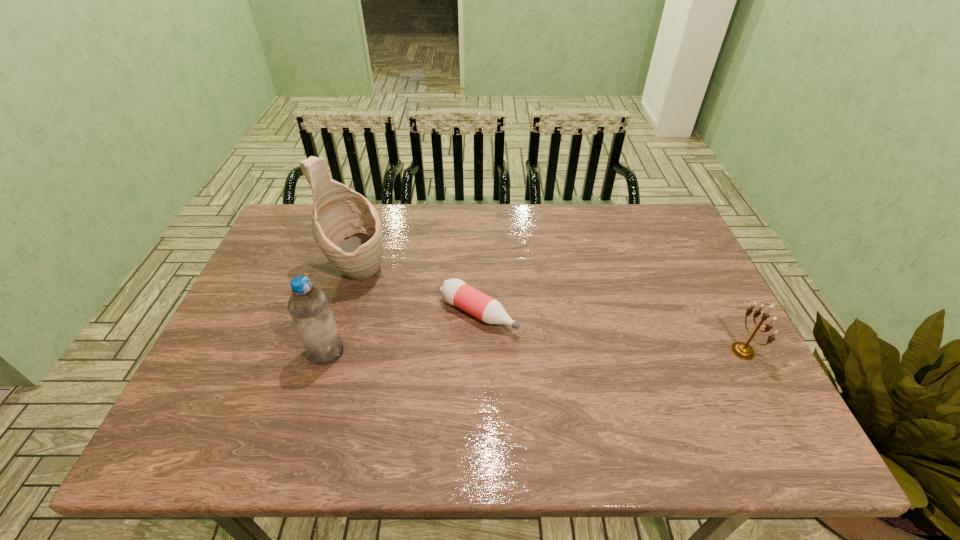
Find the location of a particular element. the third shortest object is located at coordinates (309, 308).

Find the location of a particular element. This screenshot has height=540, width=960. the third tallest object is located at coordinates (744, 351).

The image size is (960, 540). Identify the location of the rightmost object. (744, 351).

This screenshot has height=540, width=960. In order to click on the tallest object in this screenshot , I will do `click(346, 227)`.

Image resolution: width=960 pixels, height=540 pixels. Find the location of `the shortest object`. the shortest object is located at coordinates point(456,292).

Find the location of a particular element. the third object from left to right is located at coordinates point(456,292).

Identify the location of free space located on the left of the third shortest object. The height and width of the screenshot is (540, 960). (273, 352).

Where is `free location located 0.400m on the back of the candelabrum`? Image resolution: width=960 pixels, height=540 pixels. free location located 0.400m on the back of the candelabrum is located at coordinates (683, 236).

Image resolution: width=960 pixels, height=540 pixels. I want to click on vacant space located 0.380m at the spout of the pitcher, so click(x=487, y=354).

Find the location of a particular element. vacant area located at the spout of the pitcher is located at coordinates (432, 320).